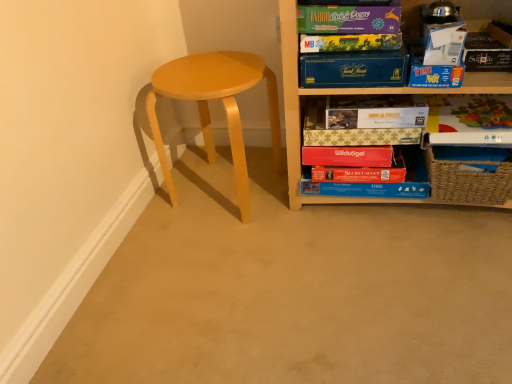
What do you see at coordinates (349, 19) in the screenshot? The image size is (512, 384). I see `matte purple board game at upper right, placed as the 1th paperback book when sorted from top to bottom` at bounding box center [349, 19].

This screenshot has height=384, width=512. I want to click on matte purple board game at upper right, placed as the 1th paperback book when sorted from top to bottom, so click(x=349, y=19).

Identify the location of matte cardboard book at right, the 5th paperback book in the top-to-bottom sequence. (469, 120).

I want to click on blue cardboard box at upper center, acting as the third paperback book starting from the top, so click(x=354, y=69).

Based on the photo, considering the relative sizes of matte yellow stool at left and wooden shelf at upper right in the image provided, is matte yellow stool at left bigger than wooden shelf at upper right?

Incorrect, matte yellow stool at left is not larger than wooden shelf at upper right.

From the image's perspective, which one is positioned lower, matte yellow stool at left or wooden shelf at upper right?

matte yellow stool at left, from the image's perspective.

Are matte yellow stool at left and wooden shelf at upper right located far from each other?

No, matte yellow stool at left is not far away from wooden shelf at upper right.

Is matte yellow stool at left facing away from wooden shelf at upper right?

No, matte yellow stool at left's orientation is not away from wooden shelf at upper right.

Is red matte paper at lower center, placed as the sixth paperback book when sorted from top to bottom, to the left or to the right of matte cardboard game at upper right, placed as the 2th paperback book when sorted from top to bottom, in the image?

red matte paper at lower center, placed as the sixth paperback book when sorted from top to bottom, is positioned on matte cardboard game at upper right, placed as the 2th paperback book when sorted from top to bottom,'s right side.

Can we say red matte paper at lower center, placed as the sixth paperback book when sorted from top to bottom, lies outside matte cardboard game at upper right, which is the fifth paperback book from bottom to top?

Absolutely, red matte paper at lower center, placed as the sixth paperback book when sorted from top to bottom, is external to matte cardboard game at upper right, which is the fifth paperback book from bottom to top.

From a real-world perspective, which object stands above the other?

matte cardboard game at upper right, which is the fifth paperback book from bottom to top.

Is matte cardboard book at right, which is the 2th paperback book from bottom to top, at the back of matte purple board game at upper right, the sixth paperback book in the bottom-to-top sequence?

No.

From the image's perspective, relative to matte cardboard book at right, which is the 2th paperback book from bottom to top, is matte purple board game at upper right, placed as the 1th paperback book when sorted from top to bottom, above or below?

Clearly, from the image's perspective, matte purple board game at upper right, placed as the 1th paperback book when sorted from top to bottom, is above matte cardboard book at right, which is the 2th paperback book from bottom to top.

Is matte purple board game at upper right, the sixth paperback book in the bottom-to-top sequence, to the left or to the right of matte cardboard book at right, the 5th paperback book in the top-to-bottom sequence, in the image?

In the image, matte purple board game at upper right, the sixth paperback book in the bottom-to-top sequence, appears on the left side of matte cardboard book at right, the 5th paperback book in the top-to-bottom sequence.

How different are the orientations of matte purple board game at upper right, placed as the 1th paperback book when sorted from top to bottom, and matte cardboard book at right, which is the 2th paperback book from bottom to top, in degrees?

matte purple board game at upper right, placed as the 1th paperback book when sorted from top to bottom, and matte cardboard book at right, which is the 2th paperback book from bottom to top, are facing 6.86 degrees away from each other.

Measure the distance from blue cardboard puzzle at lower center to matte cardboard book at upper center, which is counted as the 4th paperback book, starting from the top.

blue cardboard puzzle at lower center and matte cardboard book at upper center, which is counted as the 4th paperback book, starting from the top, are 20.78 centimeters apart.

Starting from the blue cardboard puzzle at lower center, which paperback book is the 2nd one in front? Please provide its 2D coordinates.

[(376, 111)]

Looking at this image, between blue cardboard puzzle at lower center and matte cardboard book at upper center, which is counted as the 4th paperback book, starting from the top, which one has more height?

Standing taller between the two is matte cardboard book at upper center, which is counted as the 4th paperback book, starting from the top.

From the picture: Is blue cardboard puzzle at lower center outside of matte cardboard book at upper center, which is counted as the 4th paperback book, starting from the top?

Absolutely, blue cardboard puzzle at lower center is external to matte cardboard book at upper center, which is counted as the 4th paperback book, starting from the top.

From the image's perspective, is blue cardboard box at upper center, acting as the third paperback book starting from the top, on wooden shelf at upper right?

Yes, from the image's perspective, blue cardboard box at upper center, acting as the third paperback book starting from the top, is on top of wooden shelf at upper right.

Is point (341, 61) more distant than point (510, 200)?

No, it is not.

Is there a large distance between blue cardboard box at upper center, which ranks as the 4th paperback book in bottom-to-top order, and wooden shelf at upper right?

That's not correct — blue cardboard box at upper center, which ranks as the 4th paperback book in bottom-to-top order, is a little close to wooden shelf at upper right.

Does matte purple board game at upper right, the sixth paperback book in the bottom-to-top sequence, have a greater height compared to blue cardboard puzzle at lower center?

In fact, matte purple board game at upper right, the sixth paperback book in the bottom-to-top sequence, may be shorter than blue cardboard puzzle at lower center.

Considering the relative sizes of matte purple board game at upper right, the sixth paperback book in the bottom-to-top sequence, and blue cardboard puzzle at lower center in the image provided, is matte purple board game at upper right, the sixth paperback book in the bottom-to-top sequence, bigger than blue cardboard puzzle at lower center?

Actually, matte purple board game at upper right, the sixth paperback book in the bottom-to-top sequence, might be smaller than blue cardboard puzzle at lower center.

From the image's perspective, between matte purple board game at upper right, placed as the 1th paperback book when sorted from top to bottom, and blue cardboard puzzle at lower center, which one is located above?

matte purple board game at upper right, placed as the 1th paperback book when sorted from top to bottom, from the image's perspective.

Could you tell me if matte purple board game at upper right, placed as the 1th paperback book when sorted from top to bottom, is turned towards red matte paper at lower center, acting as the first paperback book starting from the bottom?

No.

Which is closer to the camera, (393, 2) or (350, 172)?

Point (393, 2).

Image resolution: width=512 pixels, height=384 pixels. There is a red matte paper at lower center, acting as the first paperback book starting from the bottom. Identify the location of the 5th paperback book above it (from the image's perspective). (349, 19).

From the image's perspective, relative to red matte paper at lower center, placed as the sixth paperback book when sorted from top to bottom, is matte purple board game at upper right, the sixth paperback book in the bottom-to-top sequence, above or below?

From the image's perspective, matte purple board game at upper right, the sixth paperback book in the bottom-to-top sequence, appears above red matte paper at lower center, placed as the sixth paperback book when sorted from top to bottom.

Find the location of `stool below the wooden shelf at upper right (from the image's perspective)`. stool below the wooden shelf at upper right (from the image's perspective) is located at coordinates (208, 109).

You are a GUI agent. You are given a task and a screenshot of the screen. Output one action in this format:
    pyautogui.click(x=<x>, y=<y>)
    Task: Click on the 4th paperback book above the red matte paper at lower center, acting as the first paperback book starting from the bottom (from the image's perspective)
    The image size is (512, 384).
    Given the screenshot: What is the action you would take?
    pyautogui.click(x=349, y=43)

Estimate the real-world distances between objects in this image. Which object is further from blue cardboard puzzle at lower center, matte cardboard book at upper center, which ranks as the 3th paperback book in bottom-to-top order, or matte yellow stool at left?

matte yellow stool at left is further to blue cardboard puzzle at lower center.

Considering their positions, is matte purple board game at upper right, placed as the 1th paperback book when sorted from top to bottom, positioned closer to blue cardboard puzzle at lower center than matte cardboard book at right, the 5th paperback book in the top-to-bottom sequence?

matte cardboard book at right, the 5th paperback book in the top-to-bottom sequence, is positioned closer to the anchor blue cardboard puzzle at lower center.

Estimate the real-world distances between objects in this image. Which object is closer to red matte paper at lower center, placed as the sixth paperback book when sorted from top to bottom, matte yellow stool at left or matte purple board game at upper right, placed as the 1th paperback book when sorted from top to bottom?

The object closer to red matte paper at lower center, placed as the sixth paperback book when sorted from top to bottom, is matte yellow stool at left.

From the image, which object appears to be nearer to woven brown basket at lower right, matte purple board game at upper right, the sixth paperback book in the bottom-to-top sequence, or blue cardboard puzzle at lower center?

Based on the image, blue cardboard puzzle at lower center appears to be nearer to woven brown basket at lower right.

From the image, which object appears to be farther from matte cardboard game at upper right, placed as the 2th paperback book when sorted from top to bottom, blue cardboard puzzle at lower center or wooden shelf at upper right?

blue cardboard puzzle at lower center lies further to matte cardboard game at upper right, placed as the 2th paperback book when sorted from top to bottom, than the other object.

When comparing their distances from matte yellow stool at left, does woven brown basket at lower right or matte cardboard book at right, which is the 2th paperback book from bottom to top, seem closer?

Among the two, matte cardboard book at right, which is the 2th paperback book from bottom to top, is located nearer to matte yellow stool at left.

Estimate the real-world distances between objects in this image. Which object is closer to blue cardboard puzzle at lower center, woven brown basket at lower right or matte cardboard game at upper right, which is the fifth paperback book from bottom to top?

woven brown basket at lower right lies closer to blue cardboard puzzle at lower center than the other object.

Which object lies further to the anchor point matte cardboard game at upper right, which is the fifth paperback book from bottom to top, matte cardboard book at upper center, which ranks as the 3th paperback book in bottom-to-top order, or matte yellow stool at left?

matte yellow stool at left.

You are a GUI agent. You are given a task and a screenshot of the screen. Output one action in this format:
    pyautogui.click(x=<x>, y=<y>)
    Task: Click on the basket situated between red matte paper at lower center, placed as the sixth paperback book when sorted from top to bottom, and matte cardboard book at right, which is the 2th paperback book from bottom to top, from left to right
    
    Given the screenshot: What is the action you would take?
    pyautogui.click(x=469, y=175)

Locate an element on the screen. The image size is (512, 384). shelf that lies between matte purple board game at upper right, placed as the 1th paperback book when sorted from top to bottom, and woven brown basket at lower right from top to bottom is located at coordinates (345, 94).

Locate an element on the screen. The image size is (512, 384). shelf between matte cardboard game at upper right, which is the fifth paperback book from bottom to top, and woven brown basket at lower right, in the horizontal direction is located at coordinates [x=345, y=94].

I want to click on basket located between blue cardboard puzzle at lower center and matte cardboard book at right, which is the 2th paperback book from bottom to top, in the left-right direction, so click(469, 175).